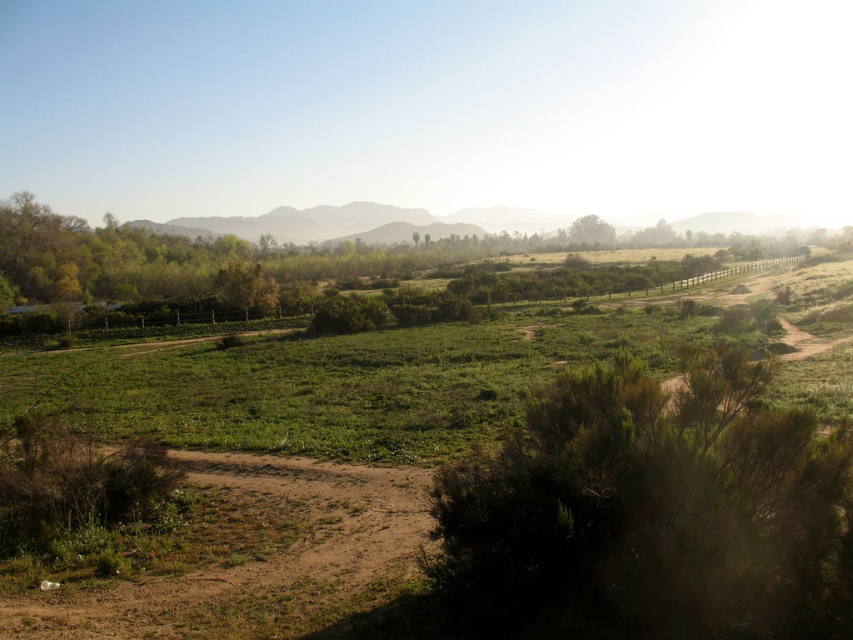
Question: Among these points, which one is farthest from the camera?

Choices:
 (A) (625, 225)
 (B) (518, 513)
 (C) (253, 300)
 (D) (326, 492)

Answer: (A)

Question: Is dark green bush at lower right thinner than brown textured tree at center?

Choices:
 (A) yes
 (B) no

Answer: (A)

Question: Does dark green bush at lower right have a smaller size compared to green grassy hillside at center?

Choices:
 (A) yes
 (B) no

Answer: (A)

Question: Is dark green bush at lower right thinner than green grassy hillside at center?

Choices:
 (A) no
 (B) yes

Answer: (B)

Question: Considering the real-world distances, which object is farthest from the dark green bush at lower right?

Choices:
 (A) green grassy hillside at center
 (B) brown dirt track at lower left

Answer: (A)

Question: Which object is the closest to the green grassy hillside at center?

Choices:
 (A) brown dirt track at lower left
 (B) brown textured tree at center

Answer: (B)